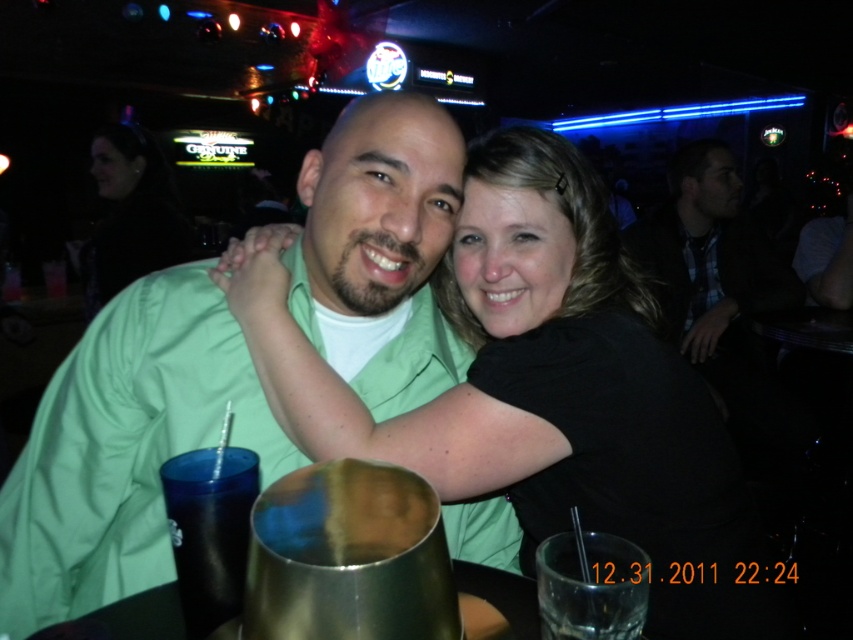
You are a photographer trying to capture a photo of the green matte shirt at center and the dark brown leather jacket at upper right. Which object should you focus on first if you want to ensure both are in focus?

The green matte shirt at center is below dark brown leather jacket at upper right, so you should focus on the dark brown leather jacket at upper right first as it is closer to the camera.

You are a photographer who wants to take a photo of the green matte shirt at center and the dark brown leather jacket at upper right. Can you see both objects clearly in the photo?

The green matte shirt at center is in front of the dark brown leather jacket at upper right, so the dark brown leather jacket at upper right might be partially obscured. However, since the green matte shirt is at center and the jacket is at upper right, both can still be visible in the photo if the focus is adjusted appropriately.